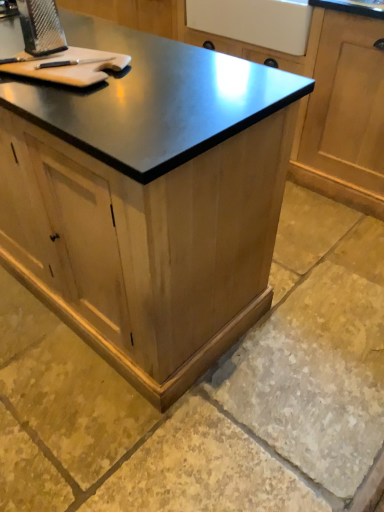
Question: In terms of size, does light brown wood cutting board at upper left appear bigger or smaller than wooden cabinet at center, arranged as the second cabinetry when viewed from the front?

Choices:
 (A) big
 (B) small

Answer: (B)

Question: Is light brown wood cutting board at upper left situated inside wooden cabinet at center, arranged as the second cabinetry when viewed from the front, or outside?

Choices:
 (A) inside
 (B) outside

Answer: (B)

Question: Which is nearer to the metallic grater at upper left?

Choices:
 (A) natural stone floor at lower center
 (B) wooden cabinet at center, which is the 1th cabinetry from front to back
 (C) wooden cabinet at center, marked as the 1th cabinetry in a back-to-front arrangement
 (D) light brown wood cutting board at upper left

Answer: (D)

Question: Considering the real-world distances, which object is closest to the metallic grater at upper left?

Choices:
 (A) wooden cabinet at center, marked as the 1th cabinetry in a back-to-front arrangement
 (B) natural stone floor at lower center
 (C) wooden cabinet at center, which ranks as the second cabinetry in back-to-front order
 (D) light brown wood cutting board at upper left

Answer: (D)